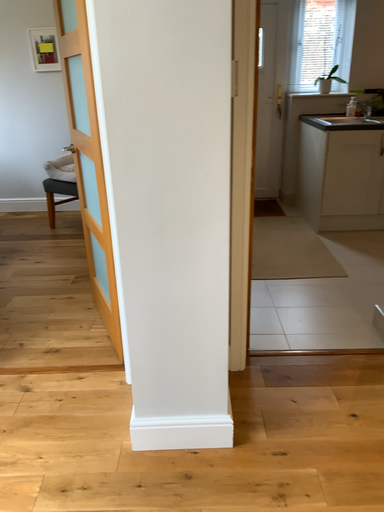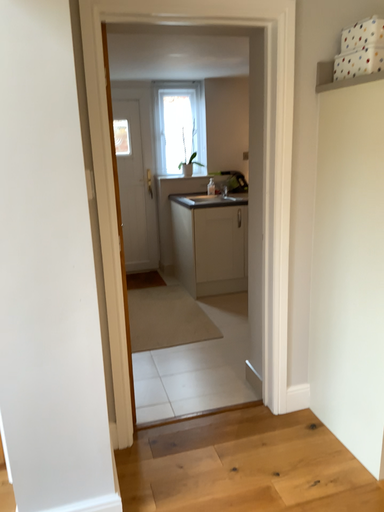
Question: How did the camera likely rotate when shooting the video?

Choices:
 (A) rotated downward
 (B) rotated upward

Answer: (B)